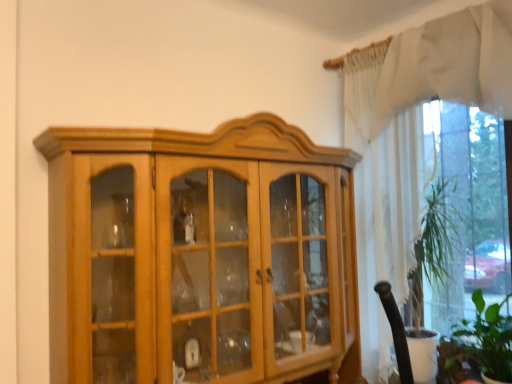
Question: Is green leafy plant at lower right at the back of white sheer curtain at upper right, which ranks as the first curtain in top-to-bottom order?

Choices:
 (A) yes
 (B) no

Answer: (B)

Question: Is green leafy plant at lower right completely or partially inside white sheer curtain at upper right, arranged as the second curtain when ordered from the bottom?

Choices:
 (A) no
 (B) yes

Answer: (A)

Question: Is white sheer curtain at upper right, arranged as the second curtain when ordered from the bottom, wider than green leafy plant at lower right?

Choices:
 (A) yes
 (B) no

Answer: (B)

Question: Does white sheer curtain at upper right, which ranks as the first curtain in top-to-bottom order, touch green leafy plant at lower right?

Choices:
 (A) yes
 (B) no

Answer: (B)

Question: From the image's perspective, does white sheer curtain at upper right, which ranks as the first curtain in top-to-bottom order, appear lower than green leafy plant at lower right?

Choices:
 (A) no
 (B) yes

Answer: (A)

Question: Visually, is light brown wood cabinet at center positioned to the left or to the right of white sheer curtain at upper right, arranged as the 1th curtain when ordered from the bottom?

Choices:
 (A) right
 (B) left

Answer: (B)

Question: Is light brown wood cabinet at center wider or thinner than white sheer curtain at upper right, arranged as the second curtain when viewed from the top?

Choices:
 (A) thin
 (B) wide

Answer: (B)

Question: From the image's perspective, is light brown wood cabinet at center located above or below white sheer curtain at upper right, arranged as the 1th curtain when ordered from the bottom?

Choices:
 (A) below
 (B) above

Answer: (A)

Question: Is point (102, 244) closer or farther from the camera than point (381, 334)?

Choices:
 (A) closer
 (B) farther

Answer: (A)

Question: In the image, is white sheer curtain at upper right, arranged as the 1th curtain when ordered from the bottom, on the left side or the right side of white sheer curtain at upper right, arranged as the second curtain when ordered from the bottom?

Choices:
 (A) right
 (B) left

Answer: (B)

Question: Looking at their shapes, would you say white sheer curtain at upper right, arranged as the second curtain when viewed from the top, is wider or thinner than white sheer curtain at upper right, arranged as the second curtain when ordered from the bottom?

Choices:
 (A) wide
 (B) thin

Answer: (A)

Question: From a real-world perspective, relative to white sheer curtain at upper right, which ranks as the first curtain in top-to-bottom order, is white sheer curtain at upper right, arranged as the second curtain when viewed from the top, vertically above or below?

Choices:
 (A) below
 (B) above

Answer: (A)

Question: Looking at the image, does white sheer curtain at upper right, arranged as the 1th curtain when ordered from the bottom, seem bigger or smaller compared to white sheer curtain at upper right, which ranks as the first curtain in top-to-bottom order?

Choices:
 (A) small
 (B) big

Answer: (B)

Question: From a real-world perspective, is light brown wood cabinet at center positioned above or below white sheer curtain at upper right, arranged as the second curtain when ordered from the bottom?

Choices:
 (A) above
 (B) below

Answer: (B)

Question: From the image's perspective, is light brown wood cabinet at center above or below white sheer curtain at upper right, which ranks as the first curtain in top-to-bottom order?

Choices:
 (A) below
 (B) above

Answer: (A)